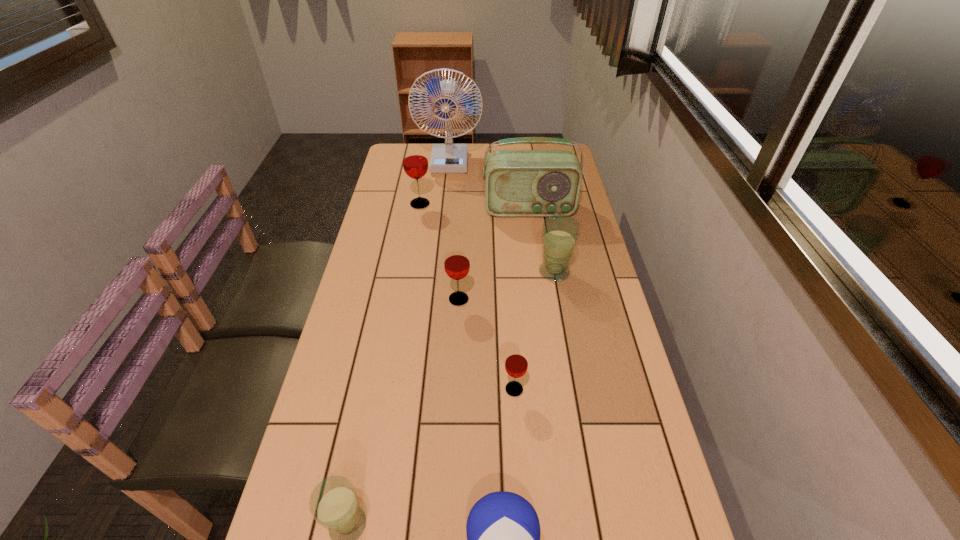
Where is `the second glass from right to left`? The image size is (960, 540). the second glass from right to left is located at coordinates (516, 363).

Where is `vacant space located on the front-facing side of the fan`? Image resolution: width=960 pixels, height=540 pixels. vacant space located on the front-facing side of the fan is located at coordinates 446,191.

Find the location of a particular element. The image size is (960, 540). free spot located 0.390m on the front panel of the seventh shortest object is located at coordinates (541, 301).

I want to click on vacant space located on the right of the biggest red glass, so click(x=468, y=204).

At what (x,y) coordinates should I click in order to perform the action: click on free space located 0.200m on the front of the second red glass from left to right. Please return your answer as a coordinate pair (x, y). This screenshot has height=540, width=960. Looking at the image, I should click on (455, 368).

The image size is (960, 540). Find the location of `blank space located on the left of the fifth nearest object`. blank space located on the left of the fifth nearest object is located at coordinates (511, 272).

The height and width of the screenshot is (540, 960). I want to click on vacant position located on the left of the rightmost red glass, so click(395, 389).

Locate an element on the screen. object that is at the far edge is located at coordinates (449, 158).

Image resolution: width=960 pixels, height=540 pixels. What are the coordinates of `fan that is positioned at the left edge` in the screenshot? It's located at (449, 158).

Find the location of a particular element. This screenshot has height=540, width=960. glass that is at the left edge is located at coordinates (415, 163).